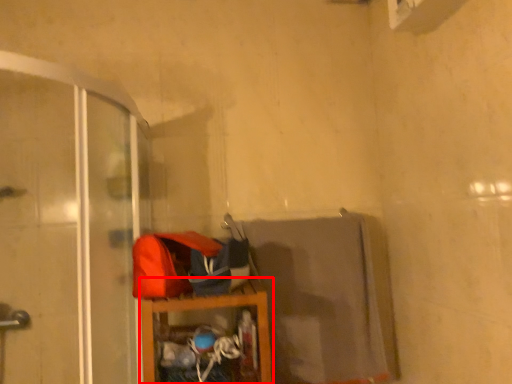
Question: In this image, where is furniture (annotated by the red box) located relative to screen door?

Choices:
 (A) left
 (B) right

Answer: (B)